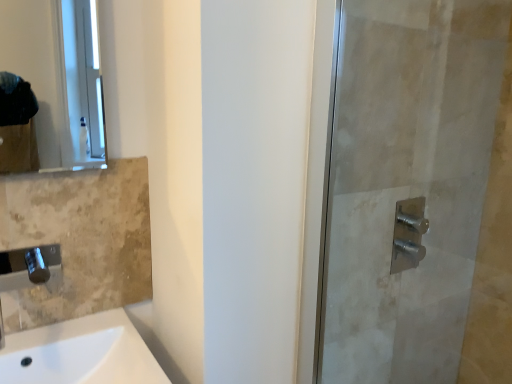
Question: Is the depth of polished chrome faucet at lower left greater than that of matte glass mirror at upper left?

Choices:
 (A) yes
 (B) no

Answer: (B)

Question: Is polished chrome faucet at lower left at the right side of matte glass mirror at upper left?

Choices:
 (A) yes
 (B) no

Answer: (B)

Question: From a real-world perspective, is polished chrome faucet at lower left positioned over matte glass mirror at upper left based on gravity?

Choices:
 (A) yes
 (B) no

Answer: (B)

Question: Does polished chrome faucet at lower left turn towards matte glass mirror at upper left?

Choices:
 (A) yes
 (B) no

Answer: (B)

Question: Is polished chrome faucet at lower left directly adjacent to matte glass mirror at upper left?

Choices:
 (A) yes
 (B) no

Answer: (B)

Question: Is matte glass mirror at upper left inside the boundaries of polished chrome faucet at lower left, or outside?

Choices:
 (A) outside
 (B) inside

Answer: (A)

Question: In the image, is matte glass mirror at upper left positioned in front of or behind polished chrome faucet at lower left?

Choices:
 (A) front
 (B) behind

Answer: (B)

Question: In terms of width, does matte glass mirror at upper left look wider or thinner when compared to polished chrome faucet at lower left?

Choices:
 (A) thin
 (B) wide

Answer: (A)

Question: From the image's perspective, is matte glass mirror at upper left above or below polished chrome faucet at lower left?

Choices:
 (A) above
 (B) below

Answer: (A)

Question: Is point click(x=0, y=289) closer or farther from the camera than point click(x=476, y=120)?

Choices:
 (A) closer
 (B) farther

Answer: (A)

Question: From a real-world perspective, relative to satin nickel shower handle at right, is polished chrome faucet at lower left vertically above or below?

Choices:
 (A) below
 (B) above

Answer: (A)

Question: From the image's perspective, is polished chrome faucet at lower left above or below satin nickel shower handle at right?

Choices:
 (A) below
 (B) above

Answer: (A)

Question: Is polished chrome faucet at lower left in front of or behind satin nickel shower handle at right in the image?

Choices:
 (A) front
 (B) behind

Answer: (A)

Question: In terms of height, does white ceramic sink at lower left look taller or shorter compared to satin nickel faucet at right?

Choices:
 (A) short
 (B) tall

Answer: (B)

Question: From the image's perspective, is white ceramic sink at lower left above or below satin nickel faucet at right?

Choices:
 (A) below
 (B) above

Answer: (A)